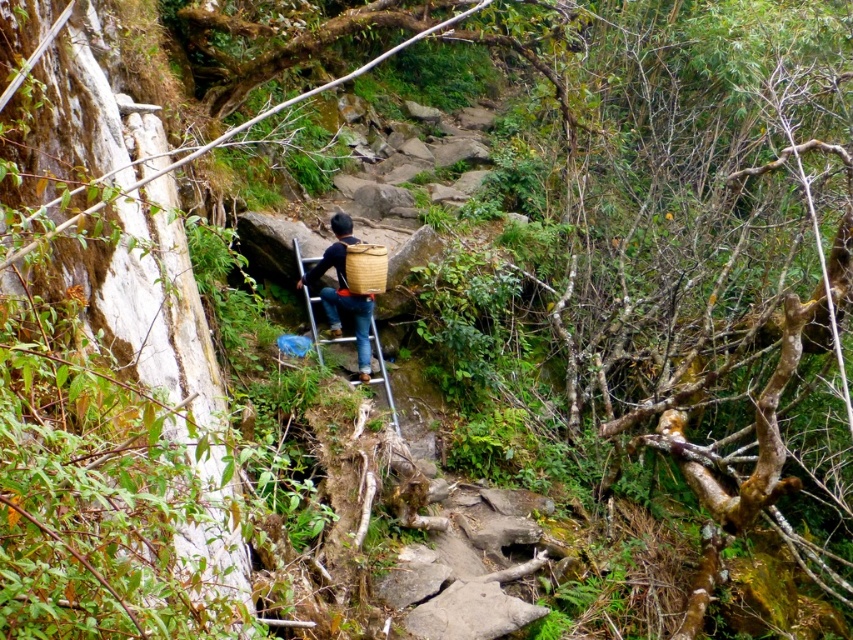
You are a hiker trying to climb the metallic silver ladder at center. There is a brown woven basket at center in your path. Which object is closer to you as you start climbing?

The brown woven basket at center is closer to you because it is positioned further to the viewer than the metallic silver ladder at center, meaning it appears nearer in your line of sight.

You are a hiker who needs to choose a basket to carry supplies. You see a brown woven basket at center and a woven bamboo basket at center. Which basket is taller?

The brown woven basket at center is taller than the woven bamboo basket at center according to the description.

You are a hiker trying to climb the steep incline in the scene. You see the metallic silver ladder at center and the woven bamboo basket at center. Which object should you use to ascend the incline safely?

You should use the metallic silver ladder at center to ascend the incline safely because it is bigger and more stable than the woven bamboo basket at center.